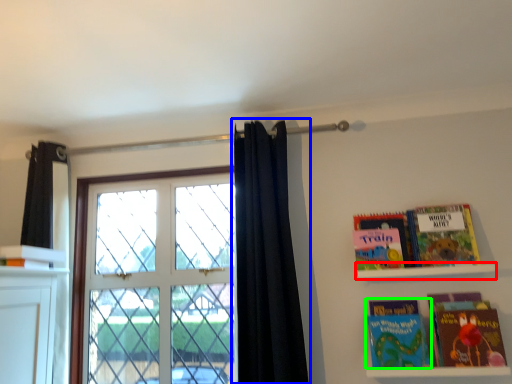
Question: Which is nearer to the shelf (highlighted by a red box)? curtain (highlighted by a blue box) or book (highlighted by a green box).

Choices:
 (A) curtain
 (B) book

Answer: (B)